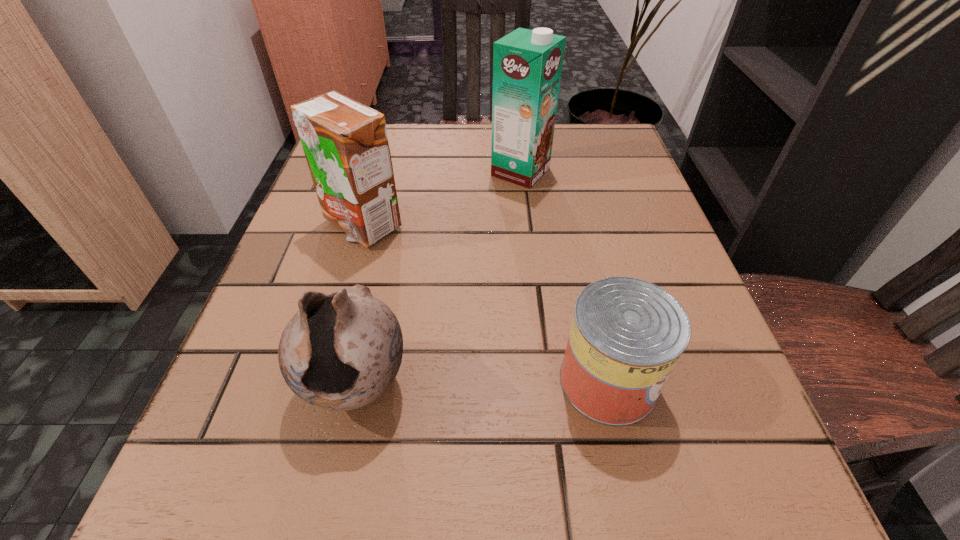
What are the coordinates of `the farther carton` in the screenshot? It's located at (527, 64).

Locate an element on the screen. The image size is (960, 540). the tallest object is located at coordinates (527, 64).

You are a GUI agent. You are given a task and a screenshot of the screen. Output one action in this format:
    pyautogui.click(x=<x>, y=<y>)
    Task: Click on the shorter carton
    This screenshot has height=540, width=960.
    Given the screenshot: What is the action you would take?
    pyautogui.click(x=345, y=143)

Locate an element on the screen. This screenshot has width=960, height=540. the left carton is located at coordinates (345, 143).

You are a GUI agent. You are given a task and a screenshot of the screen. Output one action in this format:
    pyautogui.click(x=<x>, y=<y>)
    Task: Click on the second shortest object
    The width and height of the screenshot is (960, 540).
    Given the screenshot: What is the action you would take?
    pyautogui.click(x=342, y=350)

At what (x,y) coordinates should I click in order to perform the action: click on the shortest object. Please return your answer as a coordinate pair (x, y). The image size is (960, 540). Looking at the image, I should click on (627, 335).

I want to click on vacant space located on the right of the farther carton, so click(x=578, y=172).

This screenshot has height=540, width=960. In order to click on free space located 0.270m on the straw side of the third nearest object in this screenshot , I will do (x=315, y=387).

The image size is (960, 540). I want to click on free spot located 0.100m from the spout of the second shortest object, so click(x=326, y=527).

Image resolution: width=960 pixels, height=540 pixels. In order to click on vacant space located on the left of the can in this screenshot , I will do point(406,381).